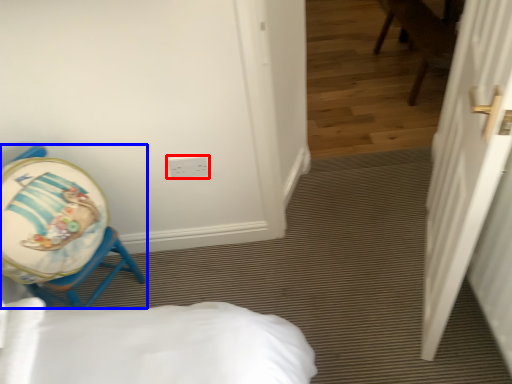
Question: Which point is closer to the camera, electric outlet (highlighted by a red box) or chair (highlighted by a blue box)?

Choices:
 (A) electric outlet
 (B) chair

Answer: (B)